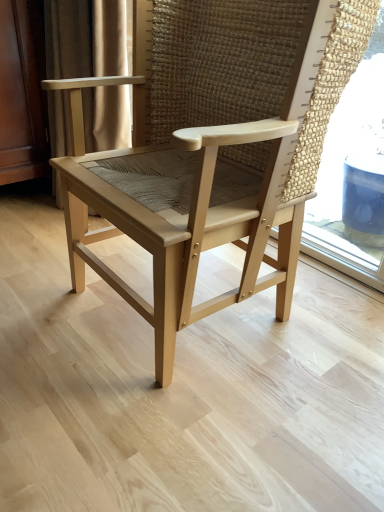
Find the location of `vacant region to the left of natural wood chair at center`. vacant region to the left of natural wood chair at center is located at coordinates (42, 297).